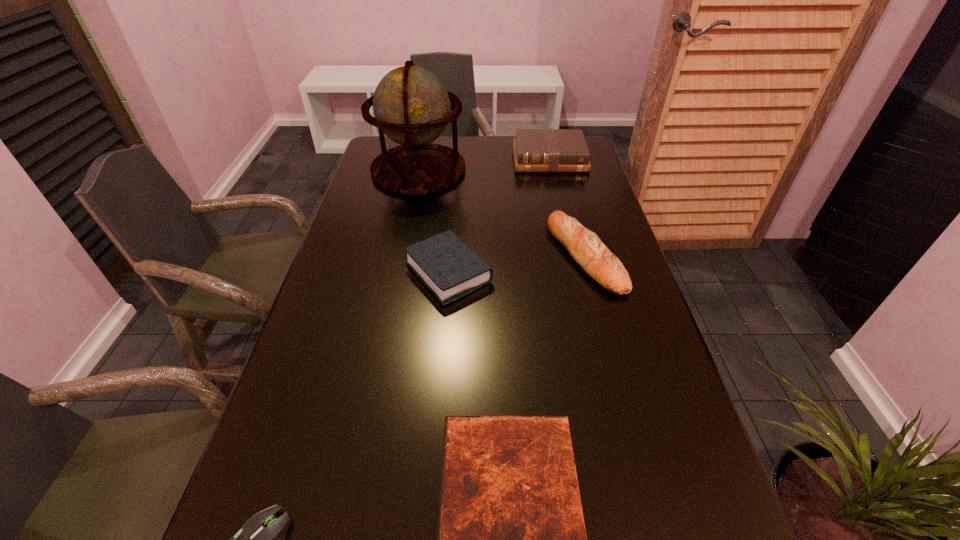
You are a GUI agent. You are given a task and a screenshot of the screen. Output one action in this format:
    pyautogui.click(x=<x>, y=<y>)
    Task: Click on the object at the left edge
    
    Given the screenshot: What is the action you would take?
    pyautogui.click(x=411, y=105)

I want to click on Bible at the right edge, so click(535, 150).

At what (x,y) coordinates should I click in order to perform the action: click on baguet located at the right edge. Please return your answer as a coordinate pair (x, y). This screenshot has width=960, height=540. Looking at the image, I should click on (585, 247).

Locate an element on the screen. object that is at the far left corner is located at coordinates (411, 105).

The height and width of the screenshot is (540, 960). What are the coordinates of `object that is at the far right corner` in the screenshot? It's located at (535, 150).

Identify the location of vacant space at the far edge. (494, 150).

In the image, there is a desktop. In order to click on free space at the left edge in this screenshot , I will do `click(375, 327)`.

Identify the location of vacant region at the right edge of the desktop. The height and width of the screenshot is (540, 960). (612, 381).

Find the location of a particular element. The image size is (960, 540). unoccupied area between the farthest Bible and the second nearest Bible is located at coordinates (499, 216).

Identify the location of vacant space in between the tallest Bible and the globe. (484, 164).